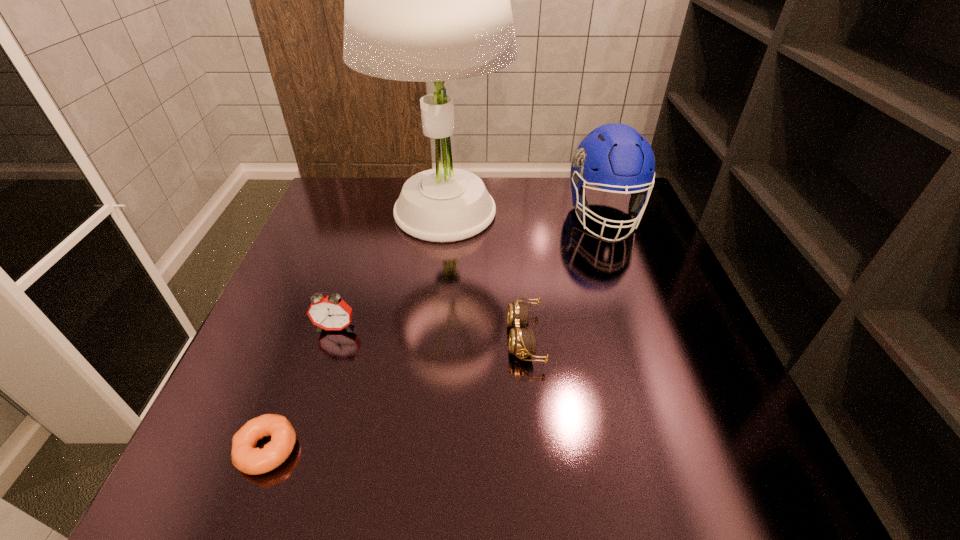
At what (x,y) coordinates should I click in order to perform the action: click on free spot located through the lenses of the second shortest object. Please return your answer as a coordinate pair (x, y). Looking at the image, I should click on (408, 339).

The image size is (960, 540). Find the location of `free space located through the lenses of the second shortest object`. free space located through the lenses of the second shortest object is located at coordinates (384, 339).

Locate an element on the screen. The width and height of the screenshot is (960, 540). vacant space located through the lenses of the second shortest object is located at coordinates (403, 339).

The image size is (960, 540). In order to click on vacant space located on the left of the nearest object in this screenshot , I will do `click(206, 449)`.

You are a GUI agent. You are given a task and a screenshot of the screen. Output one action in this format:
    pyautogui.click(x=<x>, y=<y>)
    Task: Click on the lamp that is at the far edge
    The width and height of the screenshot is (960, 540).
    Given the screenshot: What is the action you would take?
    pyautogui.click(x=426, y=0)

Where is `football helmet that is at the far edge`? This screenshot has width=960, height=540. football helmet that is at the far edge is located at coordinates (615, 157).

Where is `object positioned at the near edge`? This screenshot has height=540, width=960. object positioned at the near edge is located at coordinates (245, 457).

Identify the location of alarm clock that is positioned at the left edge. 330,312.

Identify the location of doughnut located in the left edge section of the desktop. (245, 457).

Find the location of a particular element. Image resolution: width=960 pixels, height=540 pixels. object at the right edge is located at coordinates (615, 157).